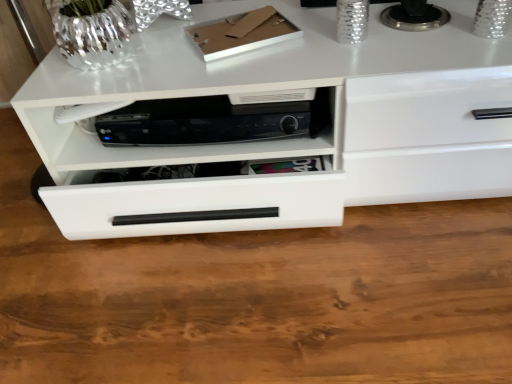
Question: Is the position of black plastic dvd player at center less distant than that of white glossy drawer at center?

Choices:
 (A) no
 (B) yes

Answer: (A)

Question: Is black plastic dvd player at center to the left of white glossy drawer at center from the viewer's perspective?

Choices:
 (A) yes
 (B) no

Answer: (A)

Question: From a real-world perspective, is black plastic dvd player at center on top of white glossy drawer at center?

Choices:
 (A) yes
 (B) no

Answer: (A)

Question: From a real-world perspective, is black plastic dvd player at center under white glossy drawer at center?

Choices:
 (A) yes
 (B) no

Answer: (B)

Question: Is black plastic dvd player at center at the right side of white glossy drawer at center?

Choices:
 (A) no
 (B) yes

Answer: (A)

Question: Is black plastic dvd player at center oriented away from white glossy drawer at center?

Choices:
 (A) no
 (B) yes

Answer: (B)

Question: Considering the relative sizes of white glossy drawer at center and black plastic dvd player at center in the image provided, is white glossy drawer at center smaller than black plastic dvd player at center?

Choices:
 (A) yes
 (B) no

Answer: (B)

Question: From a real-world perspective, is white glossy drawer at center under black plastic dvd player at center?

Choices:
 (A) no
 (B) yes

Answer: (B)

Question: Considering the relative positions of white glossy drawer at center and black plastic dvd player at center in the image provided, is white glossy drawer at center to the left of black plastic dvd player at center from the viewer's perspective?

Choices:
 (A) no
 (B) yes

Answer: (A)

Question: From the image's perspective, does white glossy drawer at center appear lower than black plastic dvd player at center?

Choices:
 (A) yes
 (B) no

Answer: (B)

Question: Does white glossy drawer at center turn towards black plastic dvd player at center?

Choices:
 (A) no
 (B) yes

Answer: (B)

Question: Does white glossy drawer at center have a lesser height compared to black plastic dvd player at center?

Choices:
 (A) yes
 (B) no

Answer: (B)

Question: In terms of width, does white glossy drawer at center look wider or thinner when compared to black plastic dvd player at center?

Choices:
 (A) wide
 (B) thin

Answer: (A)